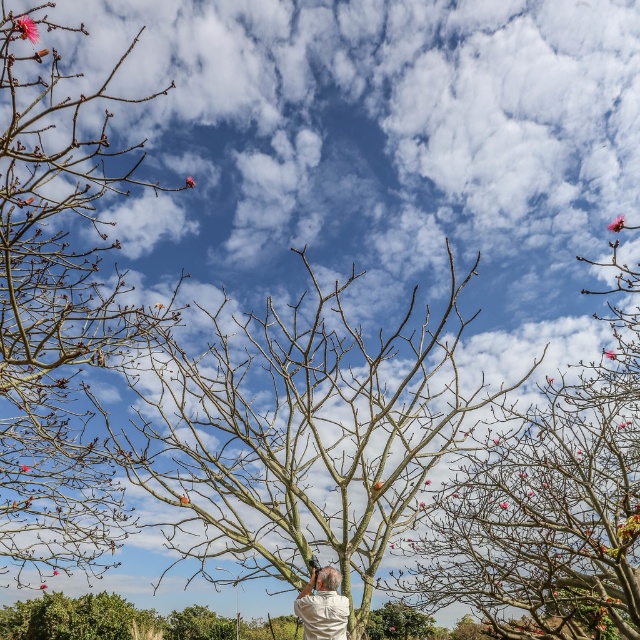
You are standing at the camera position and want to reach the bare branches at upper right to prune them. If you walk directly towards them, how far will you have to walk?

The distance between the bare branches at upper right and the camera is 37.41 feet, so you will have to walk 37.41 feet to reach them.

You are standing near the tree and want to prune the branches. You have a 1.2 meter long pruner. Can you reach the bare branches at center from your position near the white cotton shirt at center without moving closer?

The distance between the bare branches at center and the white cotton shirt at center is 1.34 meters. Since the pruner is only 1.2 meters long, you cannot reach the bare branches at center from that position without moving closer.

You are standing in a garden and want to prune the tree. You have a 5.5 meter long ladder. Can you safely reach the bare branches at center with your ladder?

The bare branches at center are 6.05 meters away from the viewer. Since the ladder is only 5.5 meters long, it is not long enough to reach the branches safely.